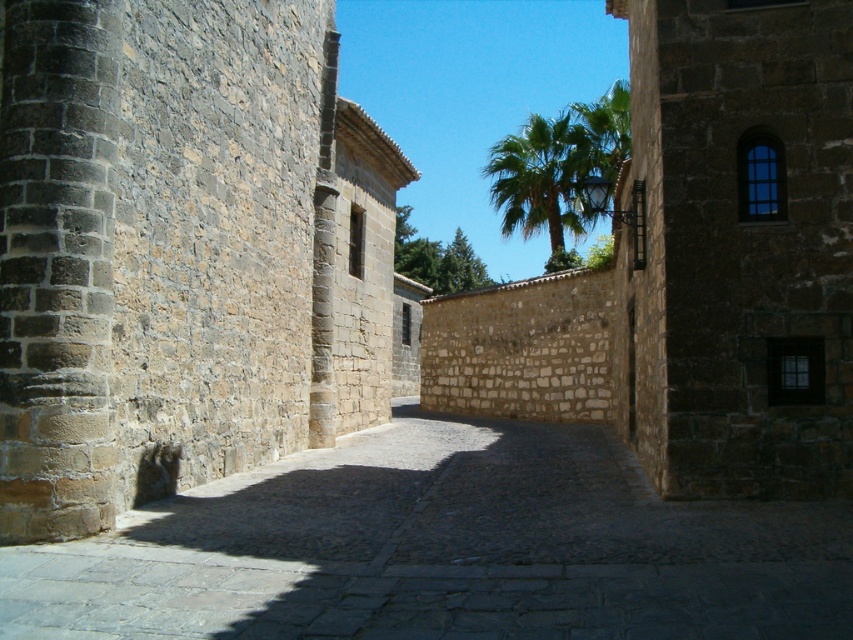
Measure the distance between point [299,508] and camera.

They are 13.64 meters apart.

Is point (334, 536) positioned behind point (489, 163)?

That is False.

Is point (461, 570) positioned after point (546, 179)?

No, it is not.

Locate an element on the screen. The image size is (853, 640). dark stone path at center is located at coordinates (442, 548).